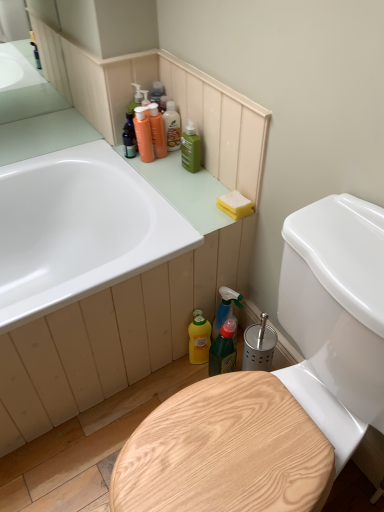
The image size is (384, 512). I want to click on blank area to the left of matte orange bottles at upper left, which ranks as the 3th cleaning product in top-to-bottom order, so [110, 154].